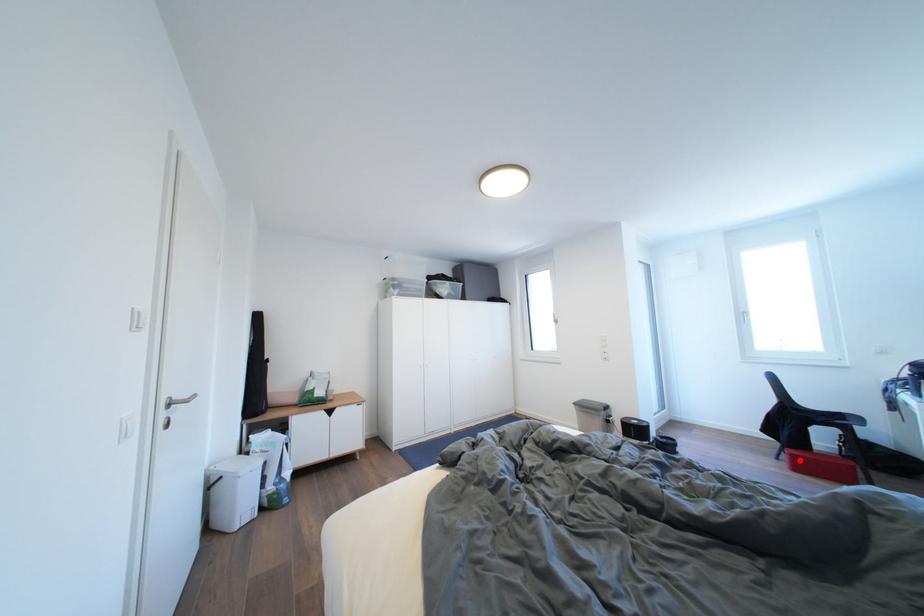
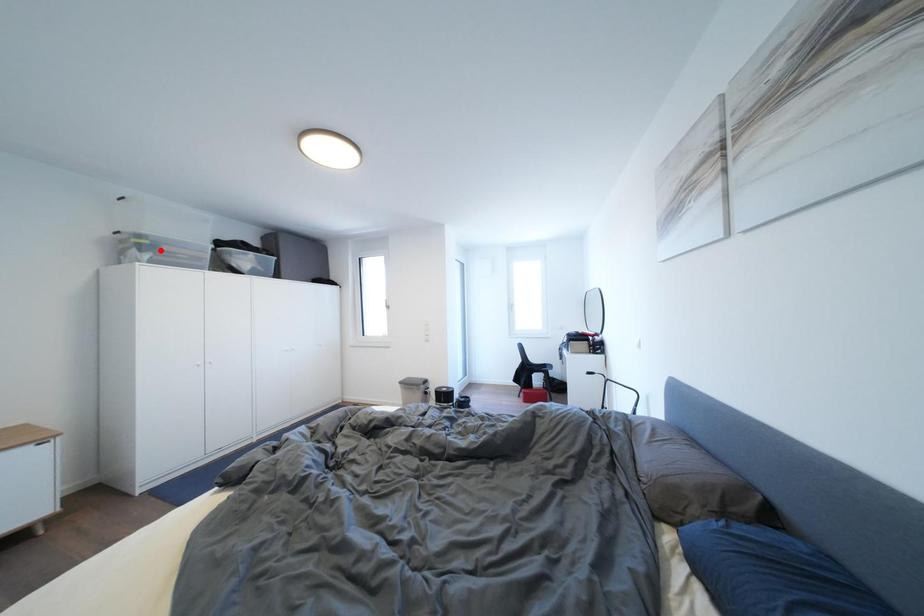
I am providing you with two images of the same scene from different viewpoints. A red point is marked on the first image and another point is marked on the second image. Are the points marked in image1 and image2 representing the same 3D position?

No